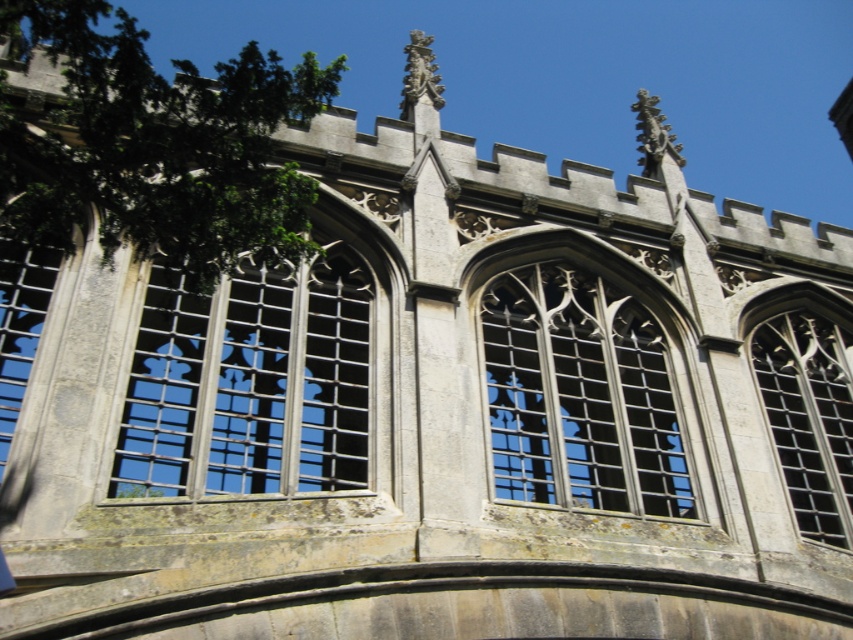
Can you confirm if green leafy tree at upper left is smaller than clear stone window at upper right?

Incorrect, green leafy tree at upper left is not smaller in size than clear stone window at upper right.

Does green leafy tree at upper left lie in front of clear stone window at upper right?

Yes, green leafy tree at upper left is in front of clear stone window at upper right.

Image resolution: width=853 pixels, height=640 pixels. What do you see at coordinates (152, 145) in the screenshot?
I see `green leafy tree at upper left` at bounding box center [152, 145].

Locate an element on the screen. This screenshot has height=640, width=853. green leafy tree at upper left is located at coordinates (152, 145).

This screenshot has height=640, width=853. I want to click on green leafy tree at upper left, so click(x=152, y=145).

Who is positioned more to the left, green leafy tree at upper left or clear glass window at center?

Positioned to the left is green leafy tree at upper left.

The image size is (853, 640). I want to click on green leafy tree at upper left, so click(x=152, y=145).

Between point (323, 88) and point (584, 451), which one is positioned behind?

Positioned behind is point (584, 451).

Is green leafy tree at upper left wider than matte stone window at center?

Correct, the width of green leafy tree at upper left exceeds that of matte stone window at center.

At what (x,y) coordinates should I click in order to perform the action: click on green leafy tree at upper left. Please return your answer as a coordinate pair (x, y). Looking at the image, I should click on (152, 145).